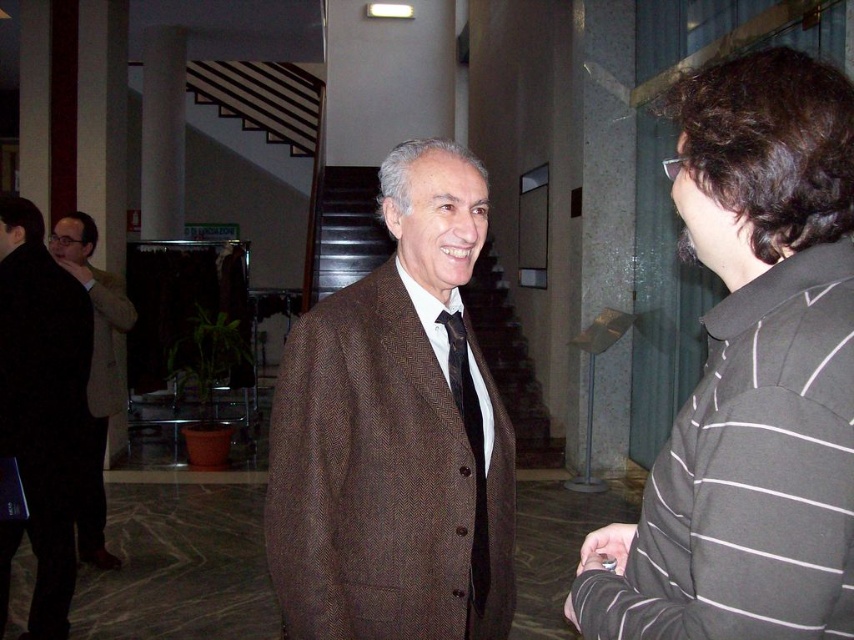
Question: Which object appears closest to the camera in this image?

Choices:
 (A) black striped shirt at right
 (B) matte black suit at left
 (C) black silk tie at center

Answer: (A)

Question: Based on their relative distances, which object is nearer to the black striped shirt at right?

Choices:
 (A) brown woolen suit at center
 (B) matte brown suit at left
 (C) matte black suit at left
 (D) black silk tie at center

Answer: (A)

Question: Can you confirm if brown woolen suit at center is positioned to the right of matte brown suit at left?

Choices:
 (A) yes
 (B) no

Answer: (A)

Question: Which object is the farthest from the black striped shirt at right?

Choices:
 (A) matte black suit at left
 (B) brown woolen suit at center

Answer: (A)

Question: Can you confirm if brown woolen suit at center is positioned above matte black suit at left?

Choices:
 (A) yes
 (B) no

Answer: (A)

Question: Does black striped shirt at right appear under brown woolen suit at center?

Choices:
 (A) yes
 (B) no

Answer: (B)